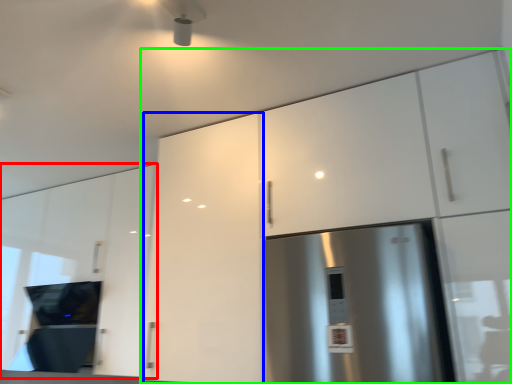
Question: Estimate the real-world distances between objects in this image. Which object is closer to cabinetry (highlighted by a red box), cabinetry (highlighted by a blue box) or cabinetry (highlighted by a green box)?

Choices:
 (A) cabinetry
 (B) cabinetry

Answer: (A)